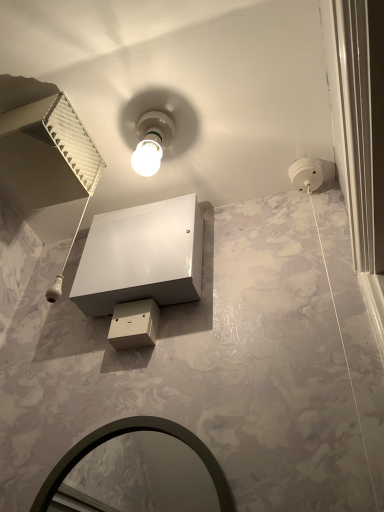
Question: Considering the relative positions of white glossy bulb at upper center and white glossy vanity at center in the image provided, is white glossy bulb at upper center to the left of white glossy vanity at center from the viewer's perspective?

Choices:
 (A) no
 (B) yes

Answer: (A)

Question: Is white glossy bulb at upper center far from white glossy vanity at center?

Choices:
 (A) yes
 (B) no

Answer: (B)

Question: Can you confirm if white glossy bulb at upper center is positioned to the right of white glossy vanity at center?

Choices:
 (A) yes
 (B) no

Answer: (A)

Question: Is white glossy vanity at center located within white glossy bulb at upper center?

Choices:
 (A) yes
 (B) no

Answer: (B)

Question: From a real-world perspective, is white glossy bulb at upper center under white glossy vanity at center?

Choices:
 (A) yes
 (B) no

Answer: (B)

Question: Would you say white glossy bulb at upper center is to the left or to the right of white glossy vanity at center in the picture?

Choices:
 (A) left
 (B) right

Answer: (B)

Question: From the image's perspective, is white glossy bulb at upper center above or below white glossy vanity at center?

Choices:
 (A) above
 (B) below

Answer: (A)

Question: Do you think white glossy bulb at upper center is within white glossy vanity at center, or outside of it?

Choices:
 (A) inside
 (B) outside

Answer: (B)

Question: Considering the positions of white glossy bulb at upper center and white glossy vanity at center in the image, is white glossy bulb at upper center taller or shorter than white glossy vanity at center?

Choices:
 (A) tall
 (B) short

Answer: (B)

Question: In the image, is matte black mirror at lower center positioned in front of or behind white glossy bulb at upper center?

Choices:
 (A) front
 (B) behind

Answer: (A)

Question: Is matte black mirror at lower center taller or shorter than white glossy bulb at upper center?

Choices:
 (A) tall
 (B) short

Answer: (A)

Question: Is matte black mirror at lower center wider or thinner than white glossy bulb at upper center?

Choices:
 (A) thin
 (B) wide

Answer: (A)

Question: Considering the relative positions of matte black mirror at lower center and white glossy bulb at upper center in the image provided, is matte black mirror at lower center to the left or to the right of white glossy bulb at upper center?

Choices:
 (A) left
 (B) right

Answer: (A)

Question: Relative to white glossy bulb at upper center, is white glossy vanity at center in front or behind?

Choices:
 (A) front
 (B) behind

Answer: (A)

Question: In terms of width, does white glossy vanity at center look wider or thinner when compared to white glossy bulb at upper center?

Choices:
 (A) thin
 (B) wide

Answer: (B)